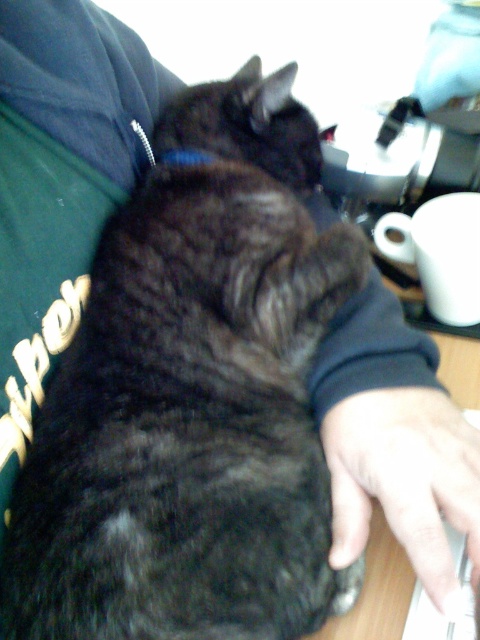
Question: Which object is positioned farthest from the fuzzy black cat at center?

Choices:
 (A) blue fabric neckband at upper center
 (B) smooth skin hand at lower right

Answer: (A)

Question: Can you confirm if fuzzy black cat at center is positioned above smooth skin hand at lower right?

Choices:
 (A) yes
 (B) no

Answer: (A)

Question: Which point is closer to the camera?

Choices:
 (A) (195, 157)
 (B) (204, 429)
 (C) (448, 426)

Answer: (B)

Question: Can you confirm if fuzzy black cat at center is smaller than smooth skin hand at lower right?

Choices:
 (A) yes
 (B) no

Answer: (B)

Question: Does fuzzy black cat at center come in front of smooth skin hand at lower right?

Choices:
 (A) yes
 (B) no

Answer: (A)

Question: Which of the following is the closest to the observer?

Choices:
 (A) smooth skin hand at lower right
 (B) blue fabric neckband at upper center

Answer: (A)